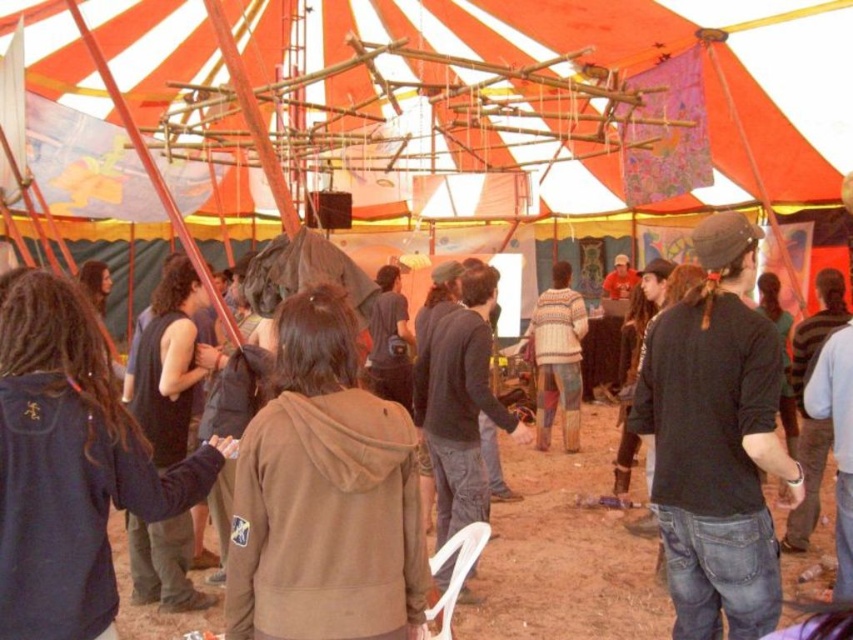
You are standing at the entrance of the tent and want to reach a specific location marked by the point at coordinates (160, 496). If your walking speed is 3 feet per second, how many seconds will it take you to reach that point?

The point at coordinates (160, 496) is 9.03 feet away from the camera, so it will take approximately 3.01 seconds to reach it since 9.03 divided by 3 equals 3.01 seconds.

You are a photographer standing outside the tent and want to capture a photo of the dark brown hair at left and the brown cotton hoodie at center. Which object should you focus on first to ensure both are in the frame without moving the camera?

You should focus on the brown cotton hoodie at center first because it is taller than the dark brown hair at left, so it will be easier to frame both by starting with the taller object.